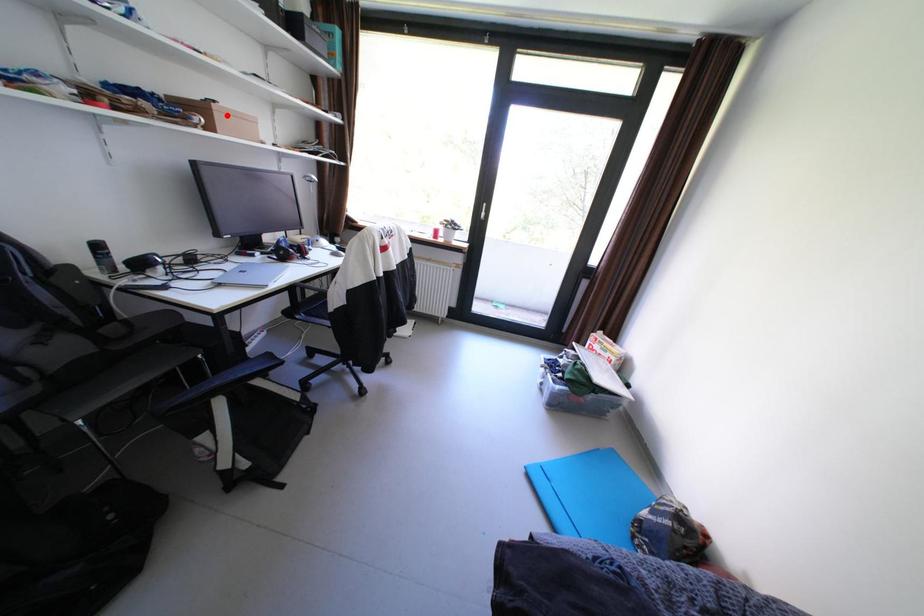
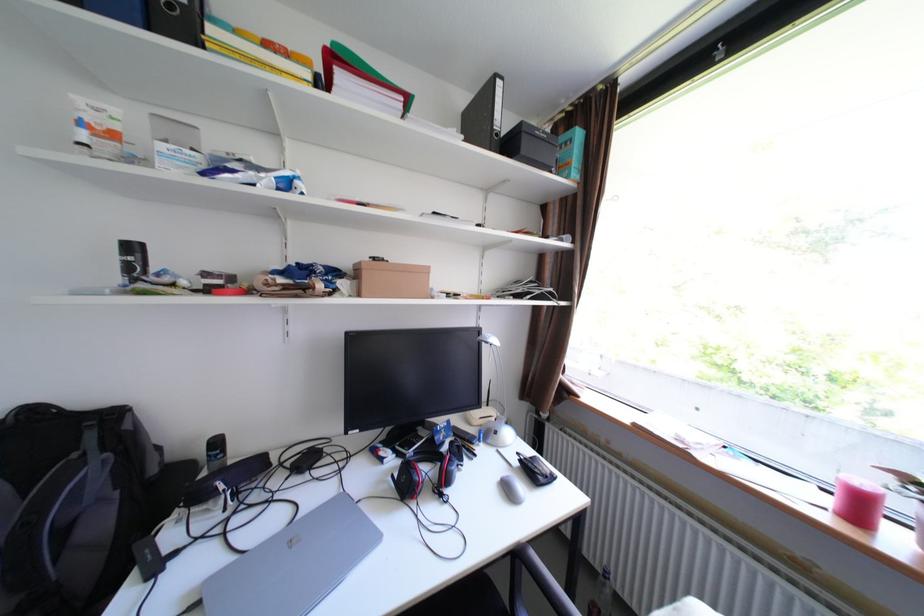
Where in the second image is the point corresponding to the highlighted location from the first image?

(375, 275)